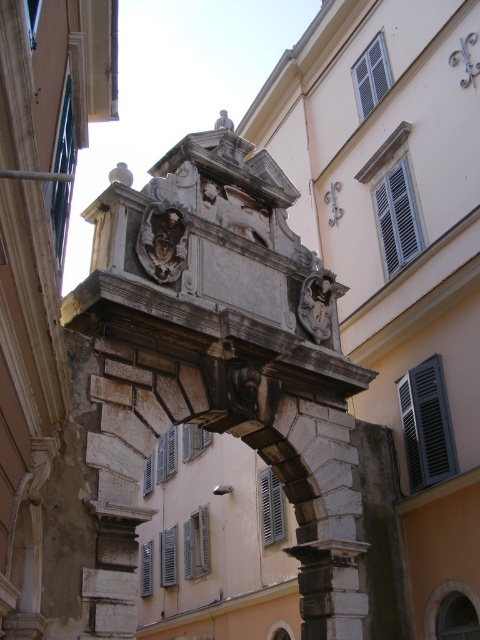
Between white stone sculpture at upper center and dark gray stone sculpture at upper center, which one has less height?

With less height is white stone sculpture at upper center.

Is white stone sculpture at upper center behind dark gray stone sculpture at upper center?

No, white stone sculpture at upper center is in front of dark gray stone sculpture at upper center.

The width and height of the screenshot is (480, 640). Describe the element at coordinates (120, 173) in the screenshot. I see `white stone sculpture at upper center` at that location.

The height and width of the screenshot is (640, 480). In order to click on white stone sculpture at upper center in this screenshot , I will do (x=120, y=173).

Is point (180, 234) positioned after point (108, 173)?

No, it is in front of (108, 173).

Which of these two, carved stone mask at center or white stone sculpture at upper center, stands shorter?

With less height is carved stone mask at center.

The width and height of the screenshot is (480, 640). What do you see at coordinates (163, 241) in the screenshot?
I see `carved stone mask at center` at bounding box center [163, 241].

This screenshot has width=480, height=640. What are the coordinates of `carved stone mask at center` in the screenshot? It's located at (163, 241).

Does carved stone mask at center appear on the right side of dark gray stone sculpture at upper center?

Incorrect, carved stone mask at center is not on the right side of dark gray stone sculpture at upper center.

At what (x,y) coordinates should I click in order to perform the action: click on carved stone mask at center. Please return your answer as a coordinate pair (x, y). Looking at the image, I should click on (163, 241).

Which is behind, point (180, 225) or point (226, 116)?

The point (226, 116) is behind.

You are a GUI agent. You are given a task and a screenshot of the screen. Output one action in this format:
    pyautogui.click(x=<x>, y=<y>)
    Task: Click on the carved stone mask at center
    This screenshot has width=480, height=640.
    Given the screenshot: What is the action you would take?
    pyautogui.click(x=163, y=241)